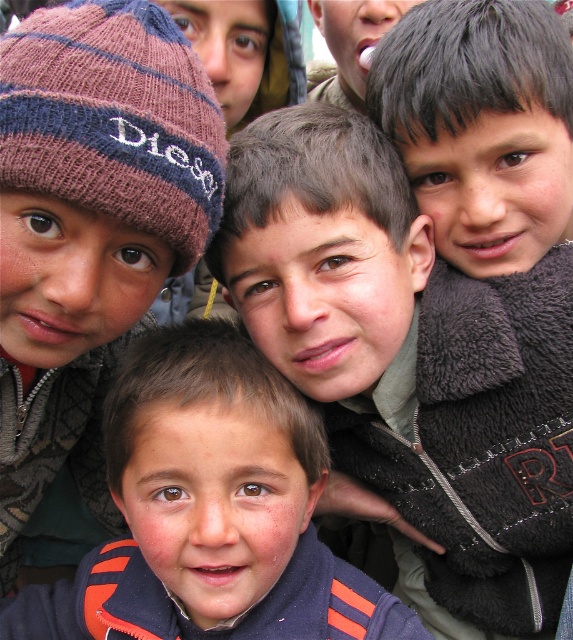
Question: Does dark blue fleece jacket at center appear under knitted woolen beanie at upper left?

Choices:
 (A) yes
 (B) no

Answer: (A)

Question: Which of the following is the closest to the observer?

Choices:
 (A) matte gray jacket at center
 (B) dark blue fleece jacket at center

Answer: (B)

Question: Is matte gray jacket at center in front of dark blue fleece jacket at center?

Choices:
 (A) yes
 (B) no

Answer: (B)

Question: Does matte gray jacket at center have a larger size compared to dark blue fleece jacket at center?

Choices:
 (A) yes
 (B) no

Answer: (A)

Question: Which point appears closest to the camera in this image?

Choices:
 (A) (233, 593)
 (B) (486, 547)

Answer: (A)

Question: Among these points, which one is farthest from the camera?

Choices:
 (A) (83, 573)
 (B) (179, 216)

Answer: (A)